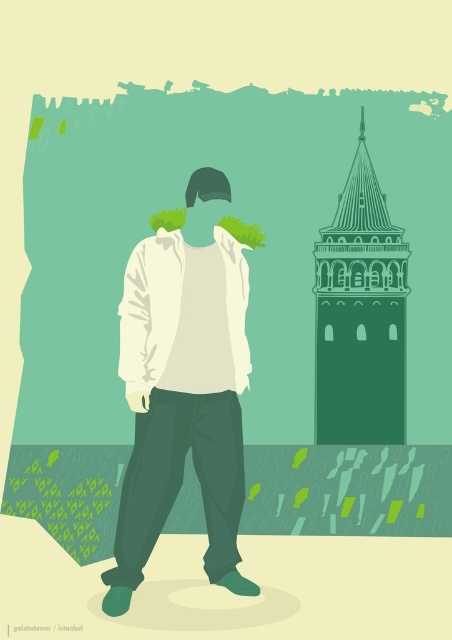
Question: Can you confirm if white matte shirt at center is thinner than green line drawing tower at right?

Choices:
 (A) yes
 (B) no

Answer: (B)

Question: Which of the following is the farthest from the observer?

Choices:
 (A) (224, 424)
 (B) (316, 422)

Answer: (B)

Question: Does white matte shirt at center appear over green line drawing tower at right?

Choices:
 (A) no
 (B) yes

Answer: (A)

Question: Is white matte shirt at center below green line drawing tower at right?

Choices:
 (A) yes
 (B) no

Answer: (A)